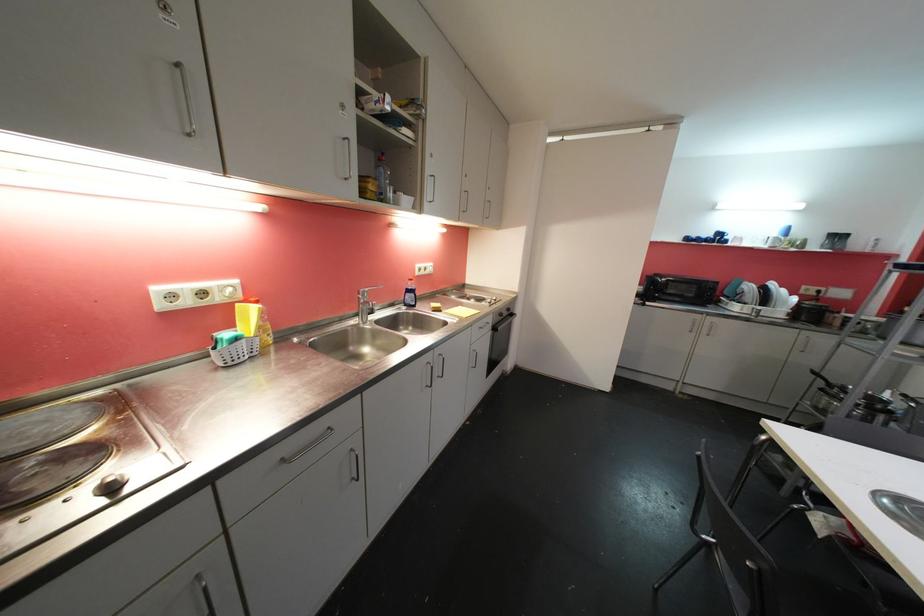
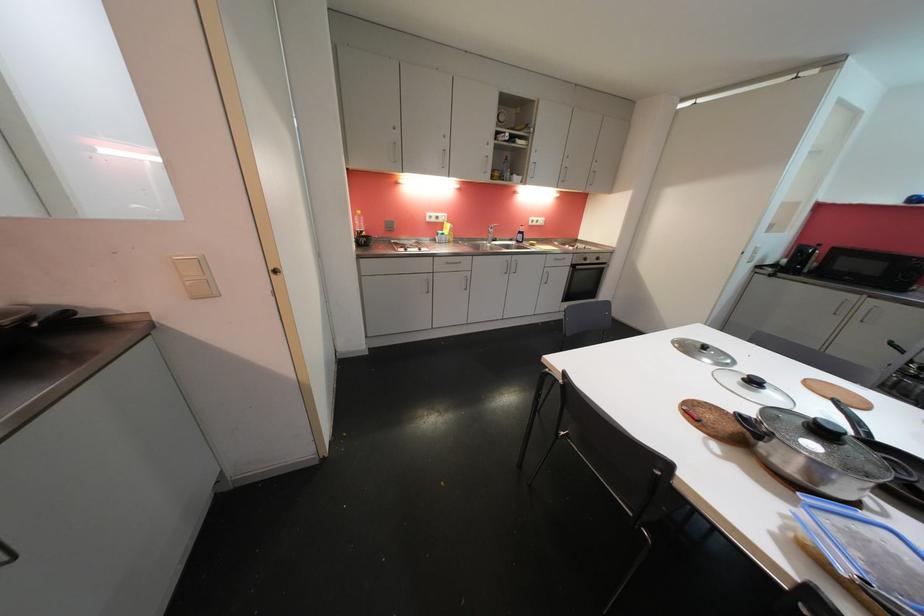
The point at (432,174) is marked in the first image. Where is the corresponding point in the second image?

(537, 163)